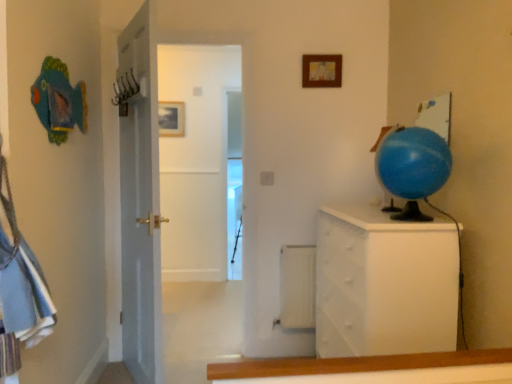
Question: Does matte gold picture frame at upper center, positioned as the first picture frame in back-to-front order, have a lesser height compared to white textured chest of drawers at right?

Choices:
 (A) no
 (B) yes

Answer: (B)

Question: Can you confirm if matte gold picture frame at upper center, which is the 2th picture frame in right-to-left order, is smaller than white textured chest of drawers at right?

Choices:
 (A) yes
 (B) no

Answer: (A)

Question: Is matte gold picture frame at upper center, positioned as the first picture frame in back-to-front order, far from white textured chest of drawers at right?

Choices:
 (A) yes
 (B) no

Answer: (A)

Question: Is matte gold picture frame at upper center, which is the 2th picture frame in right-to-left order, further to the viewer compared to white textured chest of drawers at right?

Choices:
 (A) no
 (B) yes

Answer: (B)

Question: From the image's perspective, is matte gold picture frame at upper center, acting as the first picture frame starting from the left, beneath white textured chest of drawers at right?

Choices:
 (A) no
 (B) yes

Answer: (A)

Question: Is matte gold picture frame at upper center, acting as the first picture frame starting from the left, positioned in front of white textured chest of drawers at right?

Choices:
 (A) no
 (B) yes

Answer: (A)

Question: Is wooden picture frame at upper center, the 1th picture frame positioned from the right, at the left side of blue rubber globe at right?

Choices:
 (A) no
 (B) yes

Answer: (B)

Question: Considering the relative sizes of wooden picture frame at upper center, the second picture frame viewed from the back, and blue rubber globe at right in the image provided, is wooden picture frame at upper center, the second picture frame viewed from the back, bigger than blue rubber globe at right?

Choices:
 (A) no
 (B) yes

Answer: (A)

Question: Is wooden picture frame at upper center, the 1th picture frame positioned from the right, turned away from blue rubber globe at right?

Choices:
 (A) no
 (B) yes

Answer: (A)

Question: Is wooden picture frame at upper center, the 1th picture frame positioned from the right, shorter than blue rubber globe at right?

Choices:
 (A) yes
 (B) no

Answer: (A)

Question: Is wooden picture frame at upper center, placed as the 1th picture frame when sorted from front to back, taller than blue rubber globe at right?

Choices:
 (A) yes
 (B) no

Answer: (B)

Question: Does wooden picture frame at upper center, placed as the second picture frame when sorted from left to right, have a smaller size compared to blue rubber globe at right?

Choices:
 (A) yes
 (B) no

Answer: (A)

Question: Does white textured chest of drawers at right turn towards blue rubber globe at right?

Choices:
 (A) no
 (B) yes

Answer: (A)